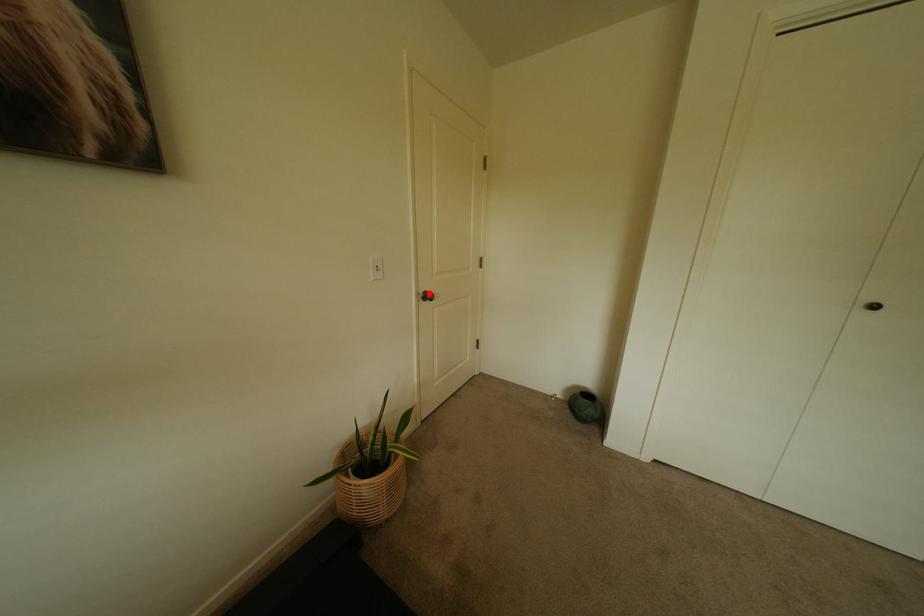
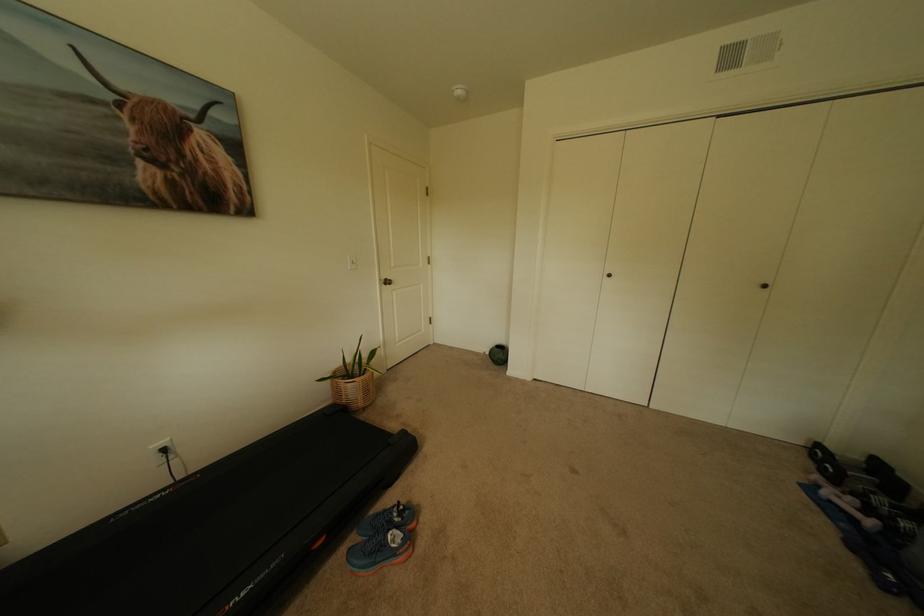
In the second image, find the point that corresponds to the highlighted location in the first image.

(391, 280)